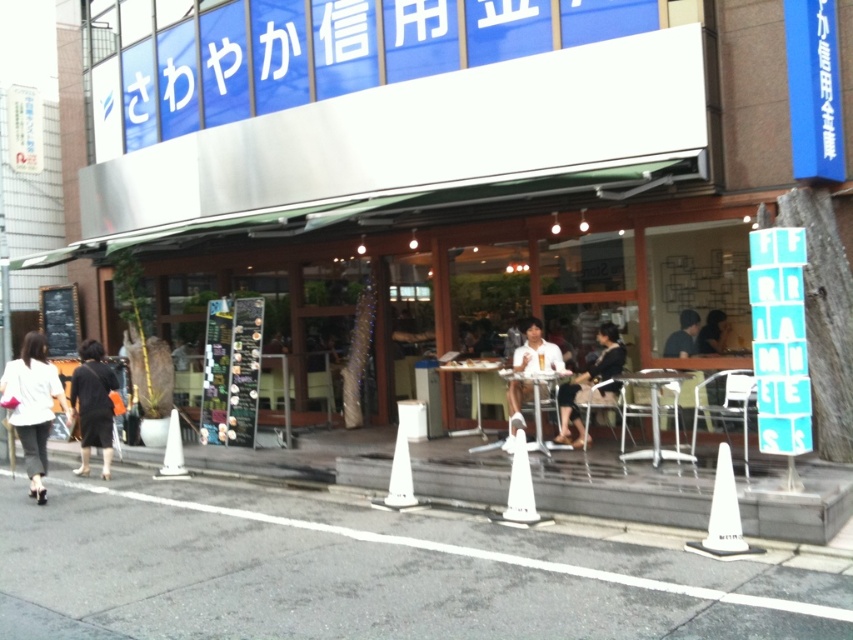
Question: Is white plastic traffic cone at lower right bigger than white plastic traffic cone at center?

Choices:
 (A) no
 (B) yes

Answer: (B)

Question: Is black fabric bag at lower left to the right of white plastic traffic cone at lower left from the viewer's perspective?

Choices:
 (A) no
 (B) yes

Answer: (A)

Question: Which object is farther from the camera taking this photo?

Choices:
 (A) white plastic traffic cone at lower center
 (B) wooden table at center
 (C) dark brown hair at upper right

Answer: (B)

Question: Considering the real-world distances, which object is farthest from the white matte shirt at center?

Choices:
 (A) wooden table at center
 (B) white plastic traffic cone at lower right
 (C) matte white shirt at center

Answer: (B)

Question: Among these points, which one is nearest to the camera?

Choices:
 (A) (560, 589)
 (B) (386, 506)
 (C) (97, 385)

Answer: (A)

Question: Does white fabric bag at lower left have a smaller size compared to white plastic traffic cone at lower right?

Choices:
 (A) yes
 (B) no

Answer: (B)